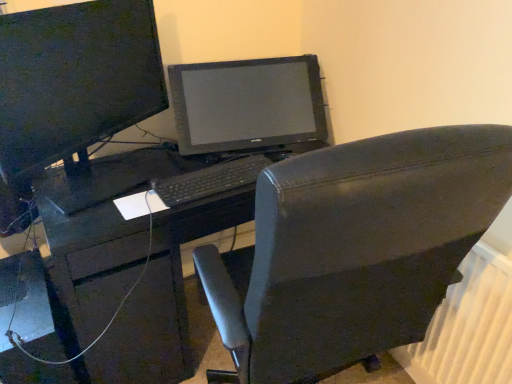
Identify the location of vacant position to the left of black plastic keyboard at center. The height and width of the screenshot is (384, 512). (137, 172).